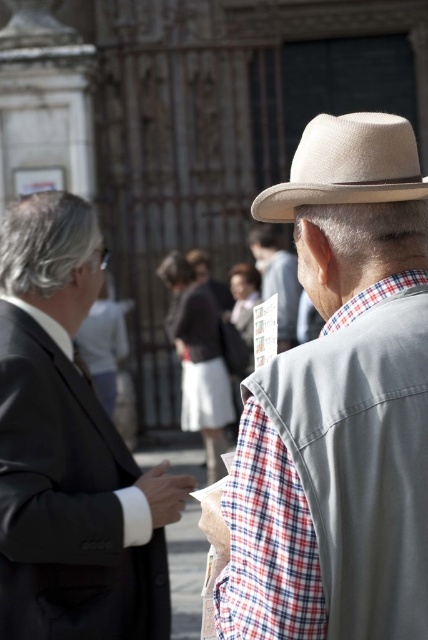
You are standing in a public space near a historic building. You see a beige straw hat at upper right and a plaid fabric shirt at center. Which object is located lower in the image?

The beige straw hat at upper right is positioned under the plaid fabric shirt at center, so it is located lower in the image.